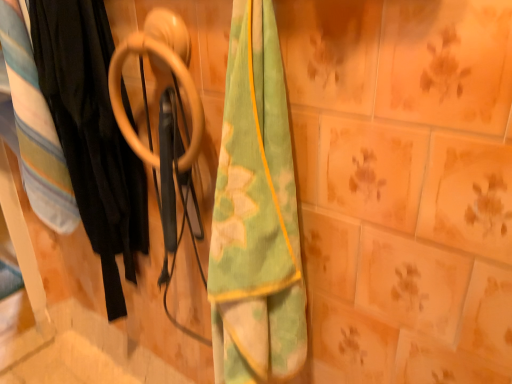
Question: Can you confirm if soft cotton blanket at left is bigger than wooden ring at center?

Choices:
 (A) no
 (B) yes

Answer: (B)

Question: Is soft cotton blanket at left outside wooden ring at center?

Choices:
 (A) yes
 (B) no

Answer: (A)

Question: Is soft cotton blanket at left directly adjacent to wooden ring at center?

Choices:
 (A) yes
 (B) no

Answer: (B)

Question: Would you consider soft cotton blanket at left to be distant from wooden ring at center?

Choices:
 (A) yes
 (B) no

Answer: (B)

Question: From a real-world perspective, is soft cotton blanket at left over wooden ring at center?

Choices:
 (A) yes
 (B) no

Answer: (B)

Question: Considering the positions of green/yellow fabric towel at center and wooden ring at center in the image, is green/yellow fabric towel at center taller or shorter than wooden ring at center?

Choices:
 (A) tall
 (B) short

Answer: (A)

Question: In terms of size, does green/yellow fabric towel at center appear bigger or smaller than wooden ring at center?

Choices:
 (A) big
 (B) small

Answer: (A)

Question: From the image's perspective, is green/yellow fabric towel at center positioned above or below wooden ring at center?

Choices:
 (A) below
 (B) above

Answer: (A)

Question: Is green/yellow fabric towel at center inside the boundaries of wooden ring at center, or outside?

Choices:
 (A) outside
 (B) inside

Answer: (A)

Question: From the image's perspective, is wooden ring at center above or below soft cotton blanket at left?

Choices:
 (A) below
 (B) above

Answer: (B)

Question: Would you say wooden ring at center is to the left or to the right of soft cotton blanket at left in the picture?

Choices:
 (A) left
 (B) right

Answer: (B)

Question: Considering the positions of point [x=123, y=51] and point [x=65, y=226], is point [x=123, y=51] closer or farther from the camera than point [x=65, y=226]?

Choices:
 (A) farther
 (B) closer

Answer: (B)

Question: Relative to soft cotton blanket at left, is wooden ring at center in front or behind?

Choices:
 (A) front
 (B) behind

Answer: (A)

Question: Considering the relative positions of soft cotton blanket at left and wooden ring at center in the image provided, is soft cotton blanket at left to the left or to the right of wooden ring at center?

Choices:
 (A) left
 (B) right

Answer: (A)

Question: Is soft cotton blanket at left bigger or smaller than wooden ring at center?

Choices:
 (A) small
 (B) big

Answer: (B)